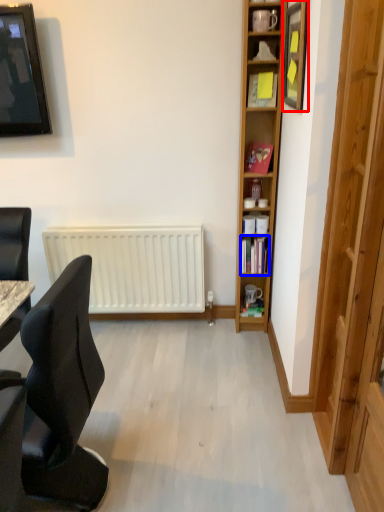
Question: Which point is closer to the camera, picture frame (highlighted by a red box) or book (highlighted by a blue box)?

Choices:
 (A) picture frame
 (B) book

Answer: (A)